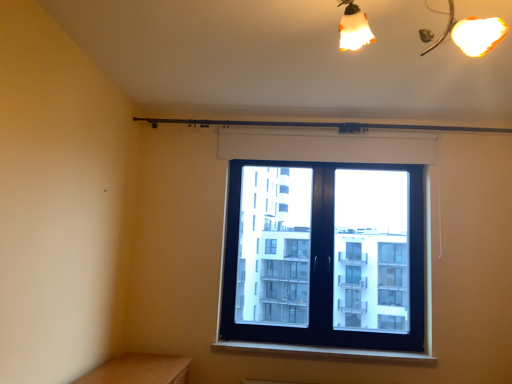
Question: Would you say white matte shutter at upper center is to the left or to the right of white plastic window sill at lower center in the picture?

Choices:
 (A) right
 (B) left

Answer: (A)

Question: Considering the positions of white matte shutter at upper center and white plastic window sill at lower center in the image, is white matte shutter at upper center wider or thinner than white plastic window sill at lower center?

Choices:
 (A) thin
 (B) wide

Answer: (A)

Question: Which of these objects is positioned closest to the white matte shutter at upper center?

Choices:
 (A) white plastic window sill at lower center
 (B) black plastic window at center

Answer: (B)

Question: Which is nearer to the white matte shutter at upper center?

Choices:
 (A) white plastic window sill at lower center
 (B) black plastic window at center

Answer: (B)